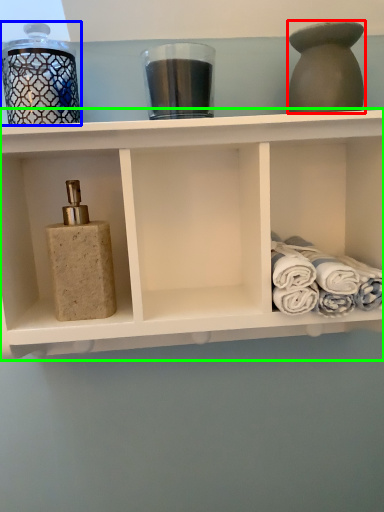
Question: Which object is positioned farthest from bottle (highlighted by a red box)? Select from glass jar (highlighted by a blue box) and shelf (highlighted by a green box).

Choices:
 (A) glass jar
 (B) shelf

Answer: (A)